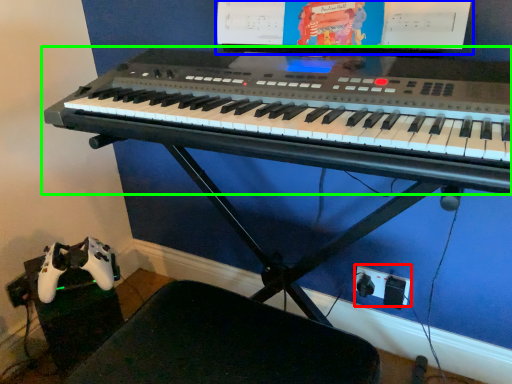
Question: Which is farther away from plug (highlighted by a red box)? computer monitor (highlighted by a blue box) or musical keyboard (highlighted by a green box)?

Choices:
 (A) computer monitor
 (B) musical keyboard

Answer: (A)